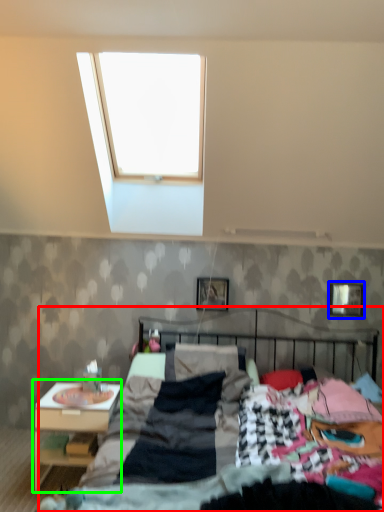
Question: Considering the real-world distances, which object is farthest from bed (highlighted by a red box)? picture frame (highlighted by a blue box) or nightstand (highlighted by a green box)?

Choices:
 (A) picture frame
 (B) nightstand

Answer: (A)